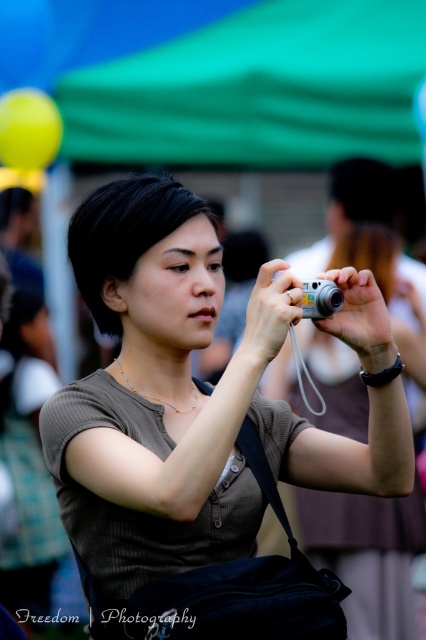
Consider the image. You are a photographer trying to focus your camera on two points in the scene. The first point is at coordinates point (296, 289) and the second is at point (325, 289). Which point is closer to the camera?

Point (296, 289) is closer to the camera than point (325, 289).